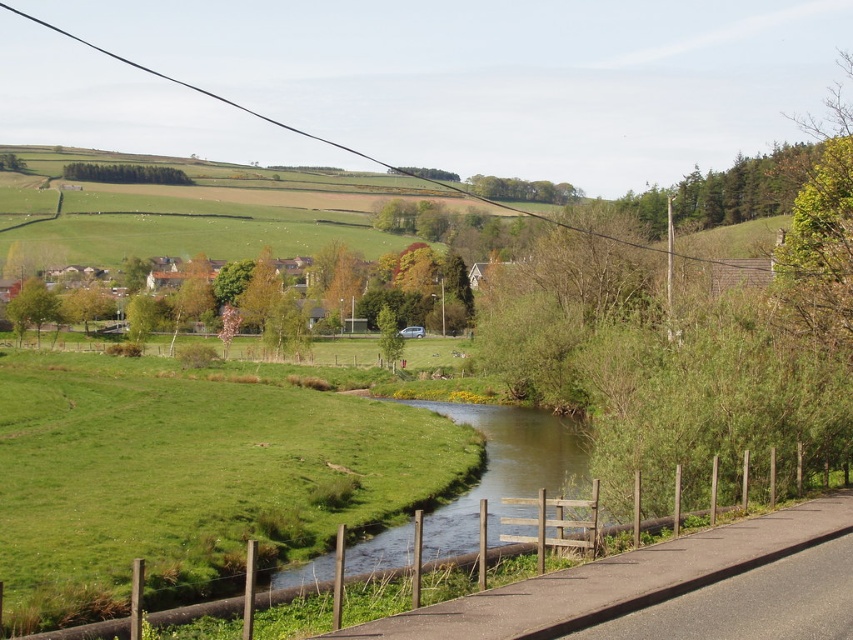
Does green leafy trees at upper left have a smaller size compared to green leafy tree at upper left?

Actually, green leafy trees at upper left might be larger than green leafy tree at upper left.

Based on the photo, does green leafy trees at upper left appear under green leafy tree at upper left?

Correct, green leafy trees at upper left is located below green leafy tree at upper left.

Which is in front, point (184, 182) or point (4, 170)?

Point (4, 170) is more forward.

Where is `green leafy trees at upper left`? green leafy trees at upper left is located at coordinates (125, 173).

Is green grassy stream at center below green leafy tree at upper left?

Yes.

Which is in front, point (560, 467) or point (4, 161)?

Point (560, 467) is in front.

Does point (477, 504) come farther from viewer compared to point (7, 164)?

That is False.

The width and height of the screenshot is (853, 640). Identify the location of green grassy stream at center. pyautogui.click(x=505, y=470).

Can you confirm if green grassy stream at center is positioned to the left of green leafy trees at upper left?

In fact, green grassy stream at center is to the right of green leafy trees at upper left.

Between green grassy stream at center and green leafy trees at upper left, which one has less height?

Standing shorter between the two is green grassy stream at center.

Find the location of a particular element. green grassy stream at center is located at coordinates (505, 470).